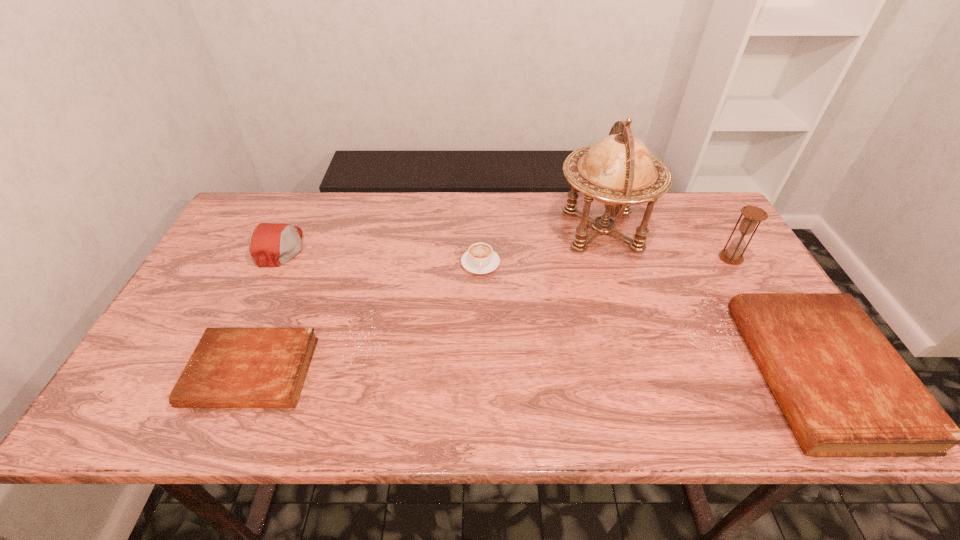
Please point a space for a new Bible to maintain equal intervals. Please provide its 2D coordinates. Your answer should be formatted as a tuple, i.e. [(x, y)], where the tuple contains the x and y coordinates of a point satisfying the conditions above.

[(536, 373)]